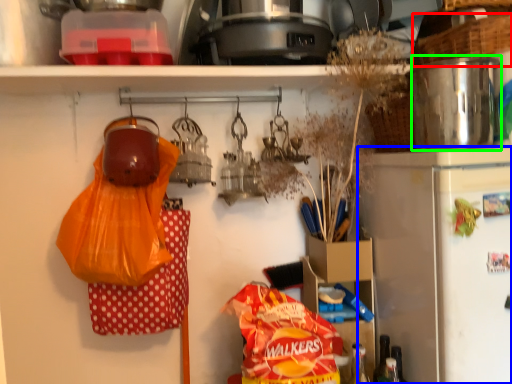
Question: Which object is positioned farthest from basket (highlighted by a red box)? Select from refrigerator (highlighted by a blue box) and appliance (highlighted by a green box).

Choices:
 (A) refrigerator
 (B) appliance

Answer: (A)